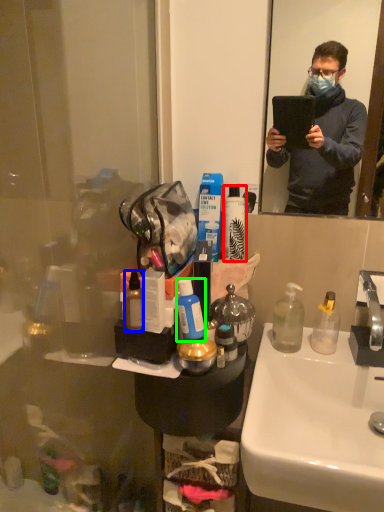
Question: Estimate the real-world distances between objects in this image. Which object is closer to toiletry (highlighted by a red box), toiletries (highlighted by a blue box) or toiletries (highlighted by a green box)?

Choices:
 (A) toiletries
 (B) toiletries

Answer: (B)